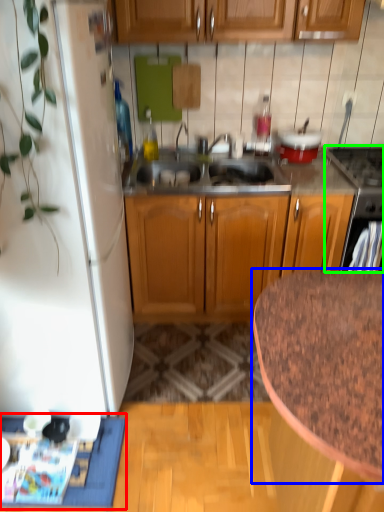
Question: Estimate the real-world distances between objects in this image. Which object is farther from doormat (highlighted by a red box), countertop (highlighted by a blue box) or appliance (highlighted by a green box)?

Choices:
 (A) countertop
 (B) appliance

Answer: (B)